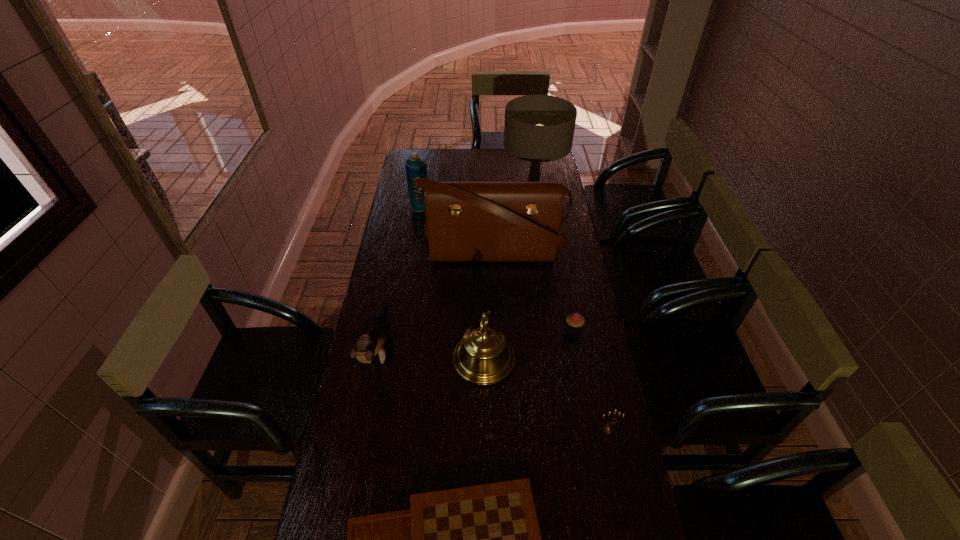
Image resolution: width=960 pixels, height=540 pixels. What are the coordinates of `free space located 0.100m on the front-facing side of the lampshade` in the screenshot? It's located at (482, 192).

Where is `free space located 0.390m on the front flap of the third farthest object`? The width and height of the screenshot is (960, 540). free space located 0.390m on the front flap of the third farthest object is located at coordinates [x=497, y=353].

Where is `vacant region located 0.390m on the front of the sixth shortest object`? vacant region located 0.390m on the front of the sixth shortest object is located at coordinates (x=410, y=270).

You are a GUI agent. You are given a task and a screenshot of the screen. Output one action in this format:
    pyautogui.click(x=<x>, y=<y>)
    Task: Click on the vacant space situated on the left of the bell
    
    Given the screenshot: What is the action you would take?
    pyautogui.click(x=391, y=360)

Locate an element on the screen. The height and width of the screenshot is (540, 960). free location located 0.270m at the face of the cat is located at coordinates (352, 480).

The height and width of the screenshot is (540, 960). In order to click on vacant region located on the front of the third shortest object in this screenshot , I will do `click(627, 516)`.

Locate an element on the screen. vacant space located 0.370m on the back of the seventh tallest object is located at coordinates (559, 253).

The width and height of the screenshot is (960, 540). Find the location of `aerosol can positioned at the left edge`. aerosol can positioned at the left edge is located at coordinates (416, 167).

What are the coordinates of `cat that is at the left edge` in the screenshot? It's located at (375, 331).

At what (x,y) coordinates should I click in order to perform the action: click on lampshade located at the right edge. Please return your answer as a coordinate pair (x, y). This screenshot has width=960, height=540. Looking at the image, I should click on (539, 128).